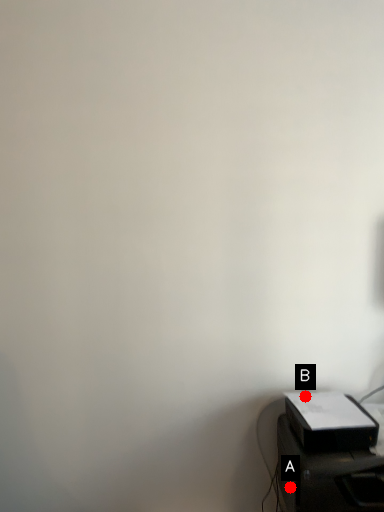
Question: Two points are circled on the image, labeled by A and B beside each circle. Which point is closer to the camera taking this photo?

Choices:
 (A) A is closer
 (B) B is closer

Answer: (A)